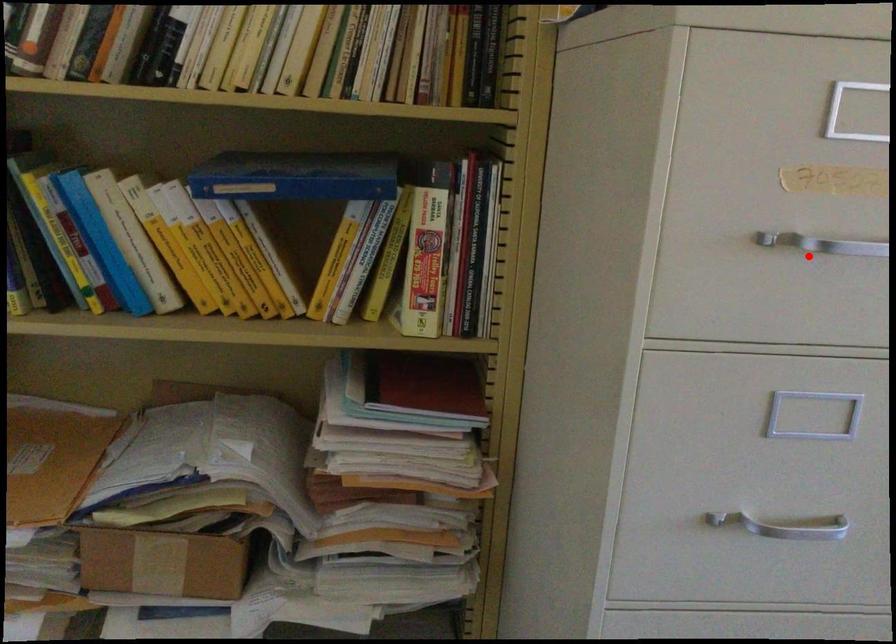
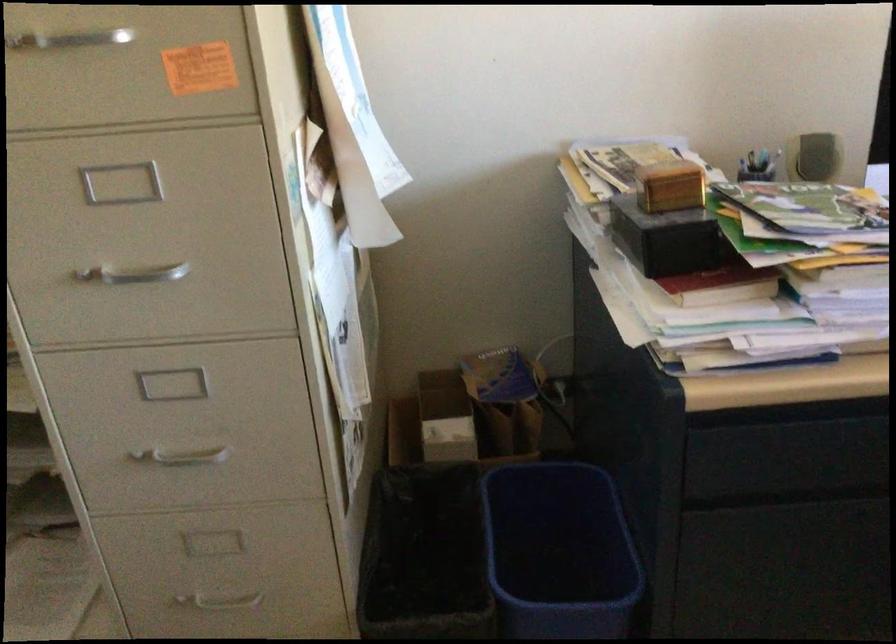
Locate, in the second image, the point that corresponds to the highlighted location in the first image.

(67, 40)